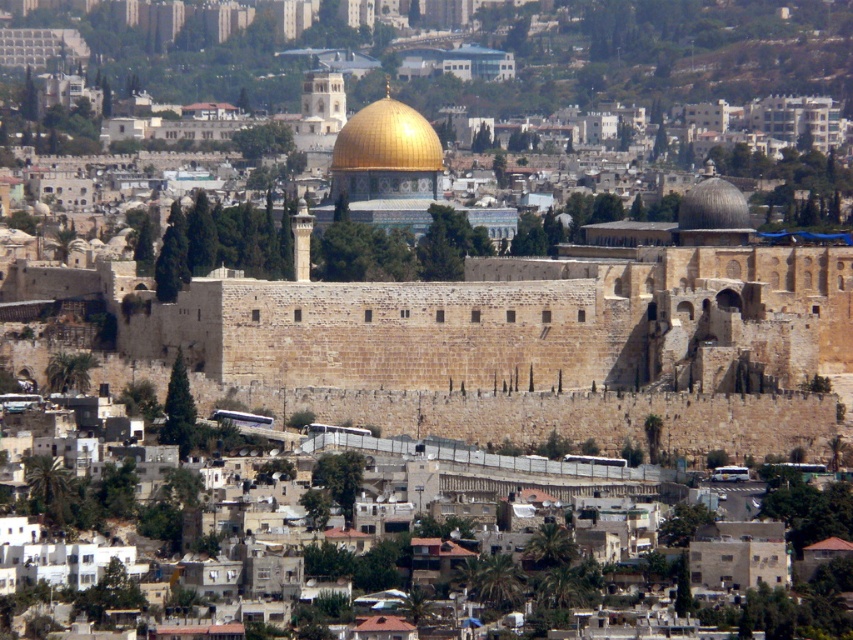
Does gold shiny dome at center appear under smooth stone dome at upper right?

No, gold shiny dome at center is not below smooth stone dome at upper right.

Can you confirm if gold shiny dome at center is wider than smooth stone dome at upper right?

No.

This screenshot has width=853, height=640. I want to click on gold shiny dome at center, so click(x=387, y=140).